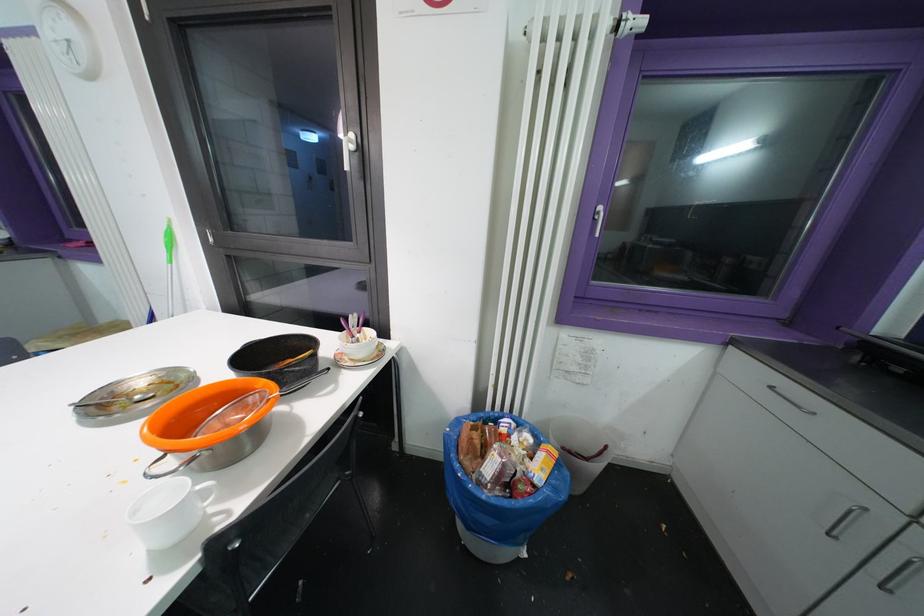
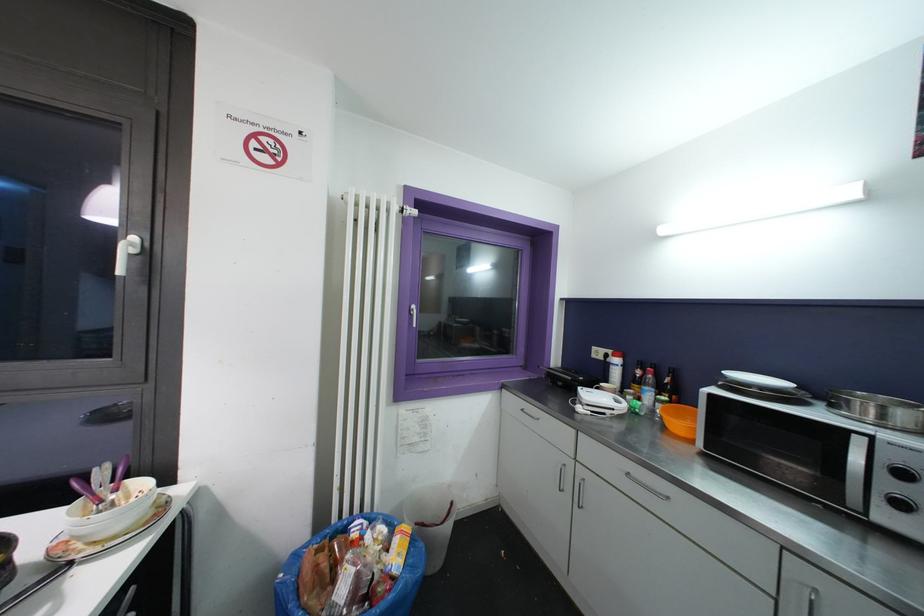
The point at [774,390] is marked in the first image. Where is the corresponding point in the second image?

(526, 413)